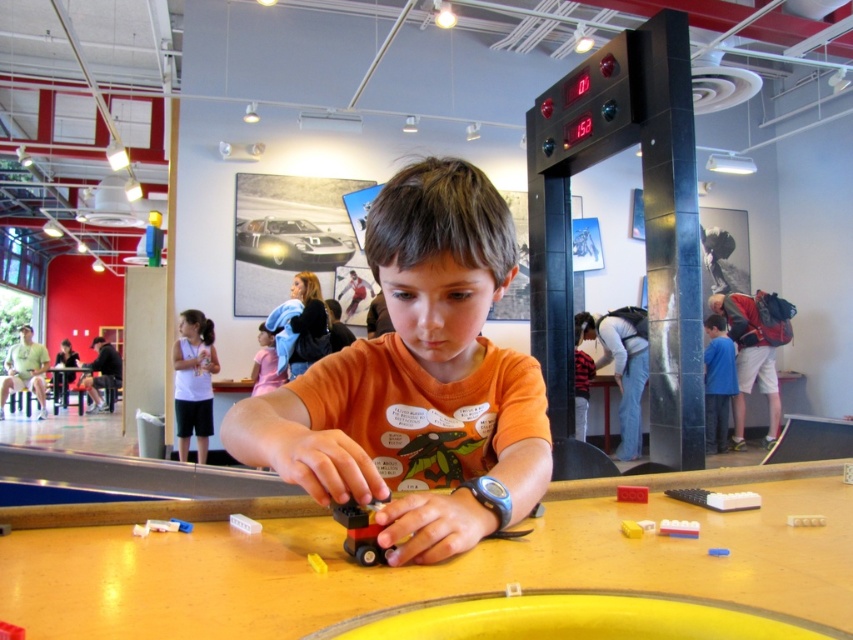
Question: Which object is farther from the camera taking this photo?

Choices:
 (A) orange matte shirt at center
 (B) shiny silver car at center
 (C) smooth wooden table at center

Answer: (B)

Question: Which object is closer to the camera taking this photo?

Choices:
 (A) orange matte shirt at center
 (B) white plastic brick at center

Answer: (A)

Question: Is brick-like plastic car at center bigger than white plastic toy at center?

Choices:
 (A) yes
 (B) no

Answer: (A)

Question: Does orange matte shirt at center have a smaller size compared to blue cotton shirt at right?

Choices:
 (A) yes
 (B) no

Answer: (A)

Question: Which point is farther to the camera?

Choices:
 (A) (363, 532)
 (B) (717, 340)

Answer: (B)

Question: Is white plastic toy at center bigger than yellow plastic toy at center?

Choices:
 (A) yes
 (B) no

Answer: (A)